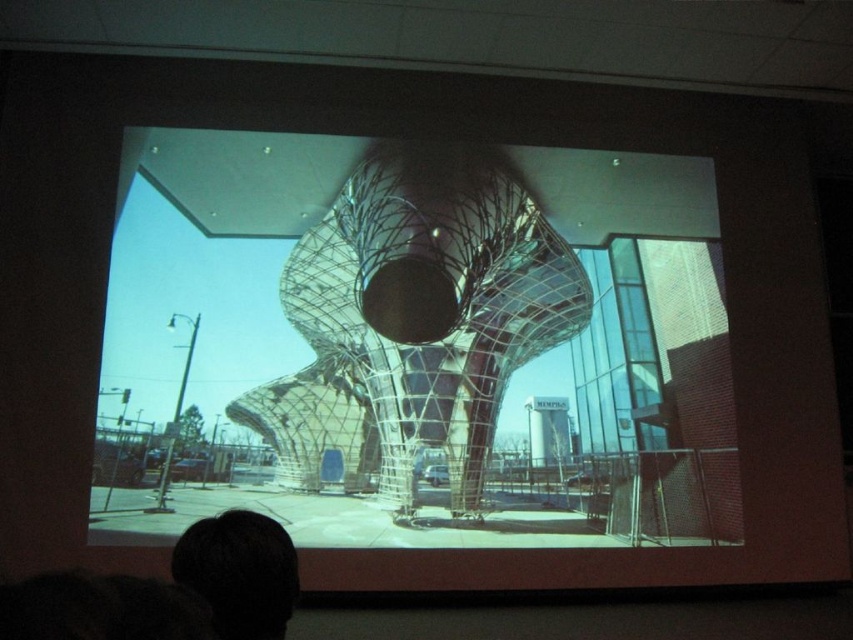
You are a photographer standing in front of the large screen showing the modern architectural structure. You notice two points on the screen labeled as point (480,504) and point (270,624). If you want to focus your camera on the point closer to you, which point should you choose?

Point (270,624) is closer to you than point (480,504), so you should focus on point (270,624) to capture the closer one.

You are standing at the dark hair at lower left and want to walk to the transparent glass sculpture at center. How many steps would you need to take if each step is 2.5 feet long?

The distance between the transparent glass sculpture at center and dark hair at lower left is 7.92 feet. Since each step is 2.5 feet, dividing 7.92 by 2.5 gives approximately 3.168 steps. Therefore, you would need to take 4 steps to reach the transparent glass sculpture at center.